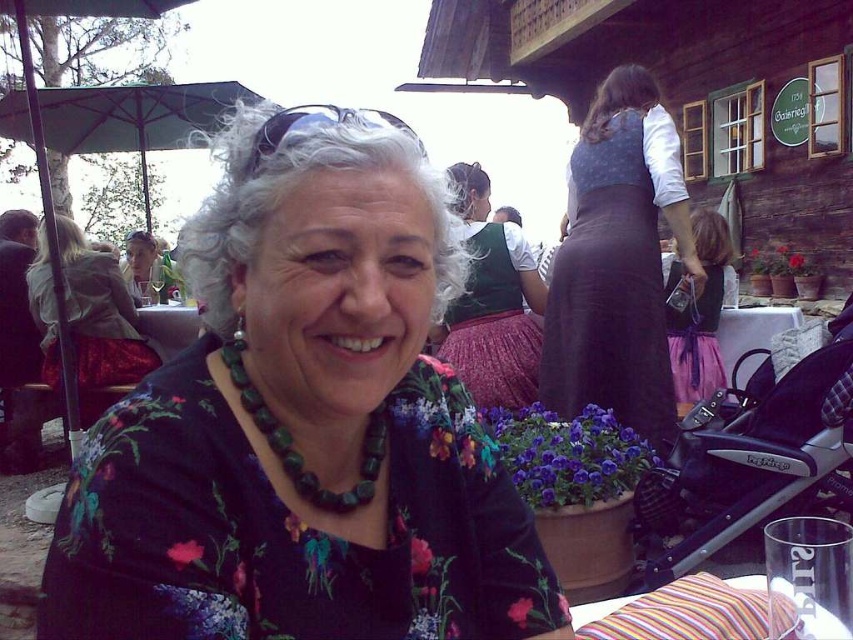
Based on the photo, you are a photographer trying to capture a photo of the dark purple skirt at upper right and the green velvet blouse at center. The camera you are using has a minimum focus distance of 15 inches. Can you focus on both objects simultaneously without moving the camera?

The dark purple skirt at upper right and green velvet blouse at center are 14.81 inches apart from each other. Since the distance between them is less than the camera minimum focus distance of 15 inches, you can focus on both objects simultaneously without moving the camera.

Consider the image. You are a photographer at the event and want to capture both the green beaded necklace at upper center and the green fabric umbrella at upper left in a single frame. Which object should you focus on first to ensure both are in the frame?

The green beaded necklace at upper center is taller than the green fabric umbrella at upper left. To ensure both are in the frame, focus on the taller object first, which is the green beaded necklace at upper center, then adjust the camera angle to include the shorter green fabric umbrella at upper left.

You are standing at the center of the scene and want to move towards the two points labeled as point (x=672, y=616) and point (x=723, y=237). Which point should you move toward first if you want to reach the one that is closer to you?

Point (x=672, y=616) is in front of point (x=723, y=237), so you should move toward point (x=672, y=616) first since it is closer to you.